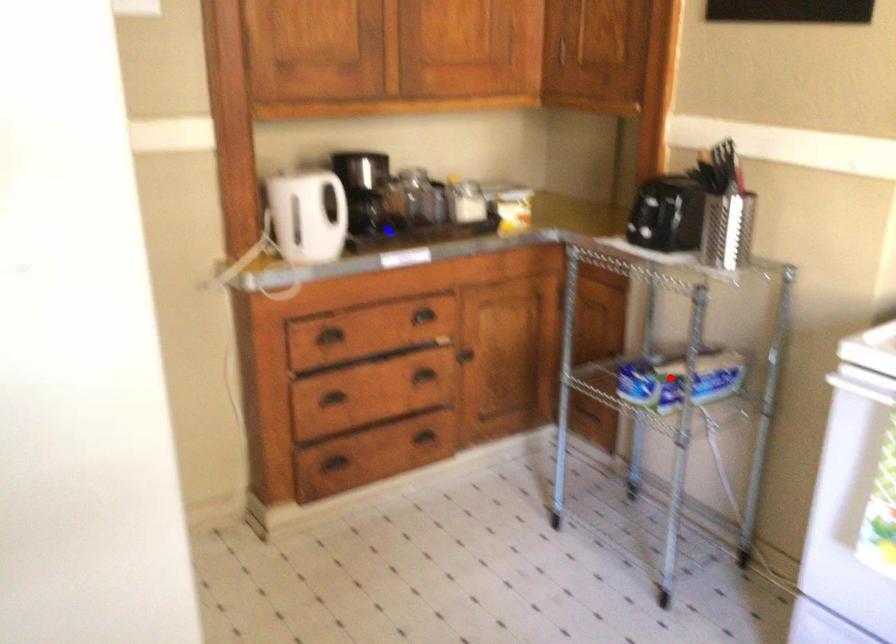
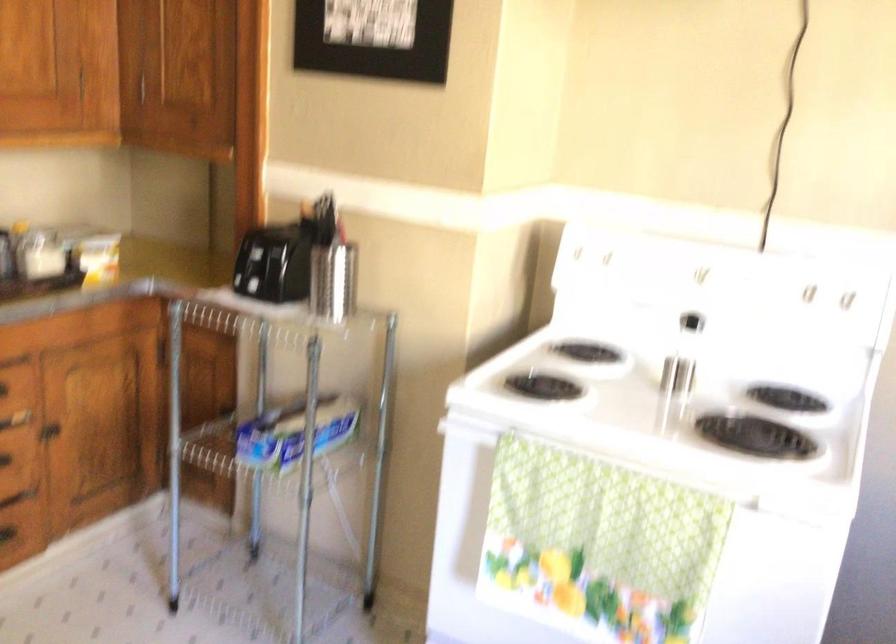
Find the pixel in the second image that matches the highlighted location in the first image.

(295, 433)